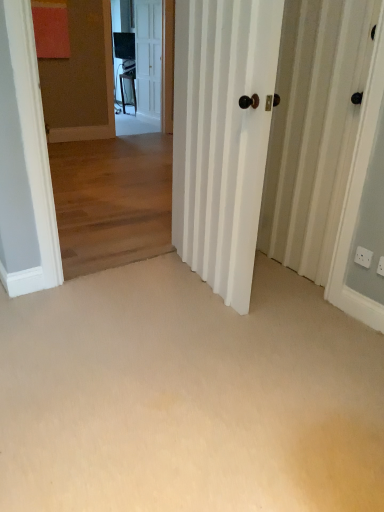
Locate an element on the screen. This screenshot has height=512, width=384. vacant area that lies between white glossy door at center, the second door positioned from the back, and wooden floor at center, the 1th corridor when ordered from top to bottom is located at coordinates tap(150, 290).